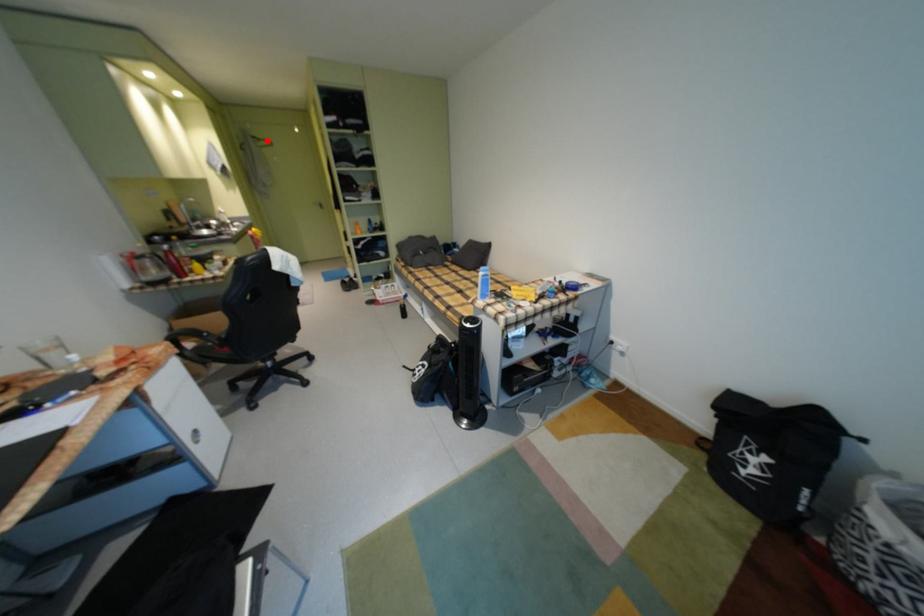
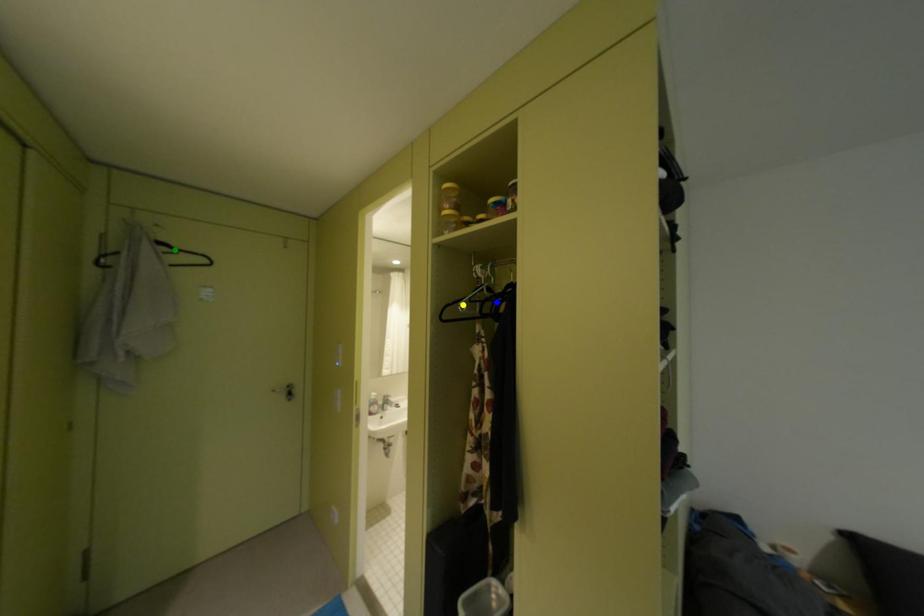
Question: I am providing you with two images of the same scene from different viewpoints. A red point is marked on the first image. You are given multiple points on the second image. Which point in image 2 represents the same 3d spot as the red point in image 1?

Choices:
 (A) green point
 (B) yellow point
 (C) blue point

Answer: (A)